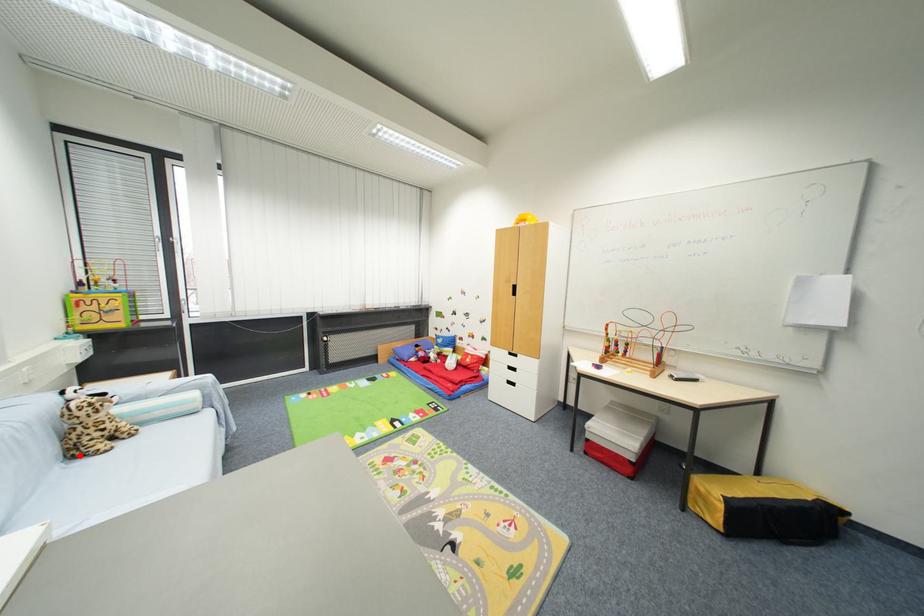
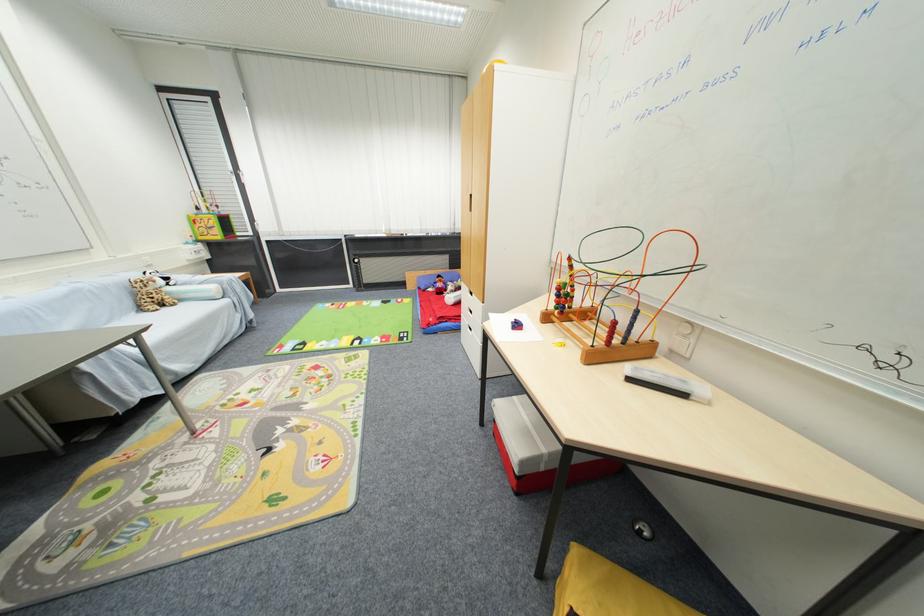
Question: I am providing you with two images of the same scene from different viewpoints. A red point is shown in image1. For the corresponding object point in image2, is it positioned nearer or farther from the camera?

Choices:
 (A) Nearer
 (B) Farther

Answer: (A)